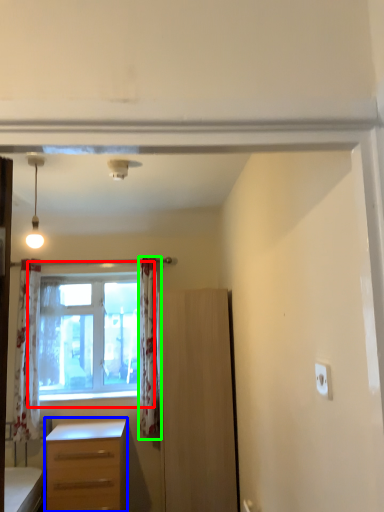
Question: Which is farther away from window (highlighted by a red box)? desk (highlighted by a blue box) or curtain (highlighted by a green box)?

Choices:
 (A) desk
 (B) curtain

Answer: (A)